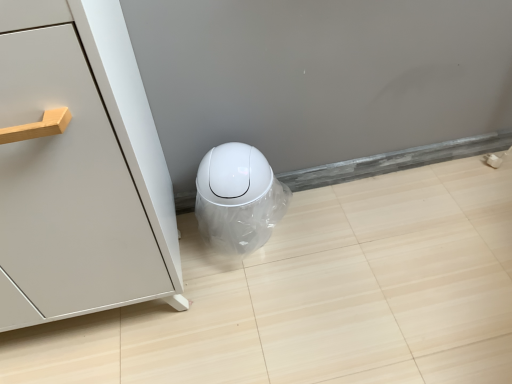
What is the approximate width of matte white cabinet at left?

It is 16.03 inches.

At what (x,y) coordinates should I click in order to perform the action: click on matte white cabinet at left. Please return your answer as a coordinate pair (x, y). The width and height of the screenshot is (512, 384). Looking at the image, I should click on (80, 169).

What do you see at coordinates (80, 169) in the screenshot?
I see `matte white cabinet at left` at bounding box center [80, 169].

Measure the distance between point (222, 175) and camera.

Point (222, 175) and camera are 3.29 feet apart.

The width and height of the screenshot is (512, 384). Find the location of `white glossy trash can at lower center`. white glossy trash can at lower center is located at coordinates (238, 198).

What do you see at coordinates (238, 198) in the screenshot?
I see `white glossy trash can at lower center` at bounding box center [238, 198].

At what (x,y) coordinates should I click in order to perform the action: click on matte white cabinet at left. Please return your answer as a coordinate pair (x, y). The width and height of the screenshot is (512, 384). Looking at the image, I should click on [x=80, y=169].

Based on their positions, is matte white cabinet at left located to the left or right of white glossy trash can at lower center?

matte white cabinet at left is positioned on white glossy trash can at lower center's left side.

Relative to white glossy trash can at lower center, is matte white cabinet at left in front or behind?

In the image, matte white cabinet at left appears in front of white glossy trash can at lower center.

Is point (0, 55) closer or farther from the camera than point (237, 147)?

Point (0, 55).

From the image's perspective, between matte white cabinet at left and white glossy trash can at lower center, who is located below?

white glossy trash can at lower center appears lower in the image.

From a real-world perspective, is matte white cabinet at left located beneath white glossy trash can at lower center?

No, from a real-world perspective, matte white cabinet at left is not below white glossy trash can at lower center.

Is matte white cabinet at left wider than white glossy trash can at lower center?

Yes, matte white cabinet at left is wider than white glossy trash can at lower center.

Can you confirm if matte white cabinet at left is shorter than white glossy trash can at lower center?

No, matte white cabinet at left is not shorter than white glossy trash can at lower center.

In terms of size, does matte white cabinet at left appear bigger or smaller than white glossy trash can at lower center?

In the image, matte white cabinet at left appears to be larger than white glossy trash can at lower center.

Is matte white cabinet at left inside the boundaries of white glossy trash can at lower center, or outside?

matte white cabinet at left lies outside white glossy trash can at lower center.

Would you consider matte white cabinet at left to be distant from white glossy trash can at lower center?

No.

Is matte white cabinet at left turned away from white glossy trash can at lower center?

matte white cabinet at left is not turned away from white glossy trash can at lower center.

Identify the location of porcelain that appears on the right of matte white cabinet at left. The image size is (512, 384). (238, 198).

Does white glossy trash can at lower center appear on the right side of matte white cabinet at left?

Indeed, white glossy trash can at lower center is positioned on the right side of matte white cabinet at left.

Is white glossy trash can at lower center positioned behind matte white cabinet at left?

Yes, white glossy trash can at lower center is further from the camera.

Does point (219, 230) come farther from viewer compared to point (152, 233)?

Yes, it is.

From the image's perspective, which is below, white glossy trash can at lower center or matte white cabinet at left?

white glossy trash can at lower center, from the image's perspective.

From a real-world perspective, who is located lower, white glossy trash can at lower center or matte white cabinet at left?

white glossy trash can at lower center, from a real-world perspective.

Which of these two, white glossy trash can at lower center or matte white cabinet at left, is wider?

matte white cabinet at left is wider.

Considering the sizes of white glossy trash can at lower center and matte white cabinet at left in the image, is white glossy trash can at lower center taller or shorter than matte white cabinet at left?

Considering their sizes, white glossy trash can at lower center has less height than matte white cabinet at left.

Between white glossy trash can at lower center and matte white cabinet at left, which one has larger size?

Bigger between the two is matte white cabinet at left.

Is white glossy trash can at lower center completely or partially outside of matte white cabinet at left?

Indeed, white glossy trash can at lower center is completely outside matte white cabinet at left.

Is white glossy trash can at lower center far from matte white cabinet at left?

No, there isn't a large distance between white glossy trash can at lower center and matte white cabinet at left.

Is white glossy trash can at lower center looking in the opposite direction of matte white cabinet at left?

white glossy trash can at lower center does not have its back to matte white cabinet at left.

How different are the orientations of white glossy trash can at lower center and matte white cabinet at left in degrees?

They differ by 0.000262 degrees in their facing directions.

Measure the distance between white glossy trash can at lower center and matte white cabinet at left.

white glossy trash can at lower center is 12.36 inches away from matte white cabinet at left.

Identify the location of furniture located on the left of white glossy trash can at lower center. The height and width of the screenshot is (384, 512). (80, 169).

Where is `furniture in front of the white glossy trash can at lower center`? furniture in front of the white glossy trash can at lower center is located at coordinates (80, 169).

Where is `porcelain directly beneath the matte white cabinet at left (from a real-world perspective)`? porcelain directly beneath the matte white cabinet at left (from a real-world perspective) is located at coordinates (238, 198).